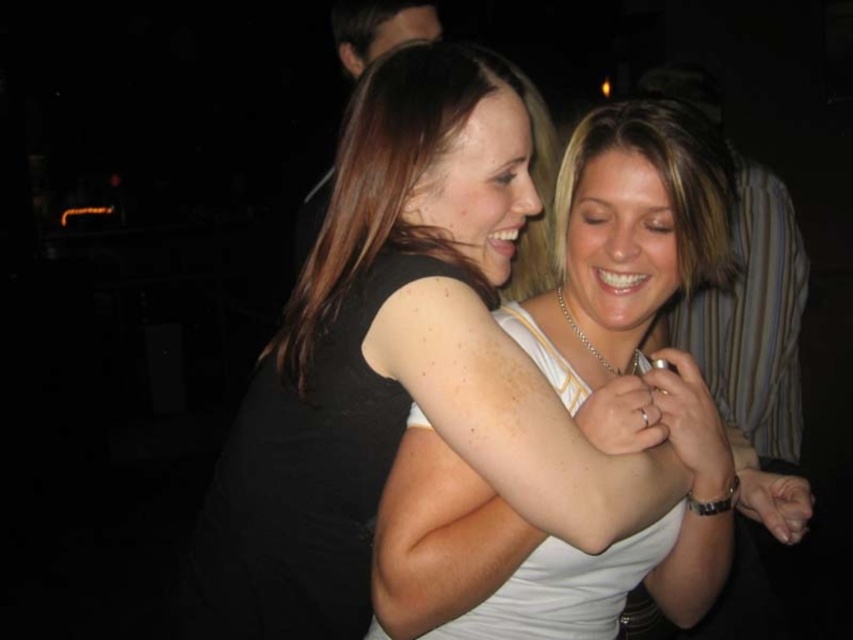
Is white tank top at center thinner than smooth black shirt at upper center?

Incorrect, white tank top at center's width is not less than smooth black shirt at upper center's.

Does white tank top at center have a greater width compared to smooth black shirt at upper center?

Yes, white tank top at center is wider than smooth black shirt at upper center.

At what (x,y) coordinates should I click in order to perform the action: click on white tank top at center. Please return your answer as a coordinate pair (x, y). Image resolution: width=853 pixels, height=640 pixels. Looking at the image, I should click on (596, 388).